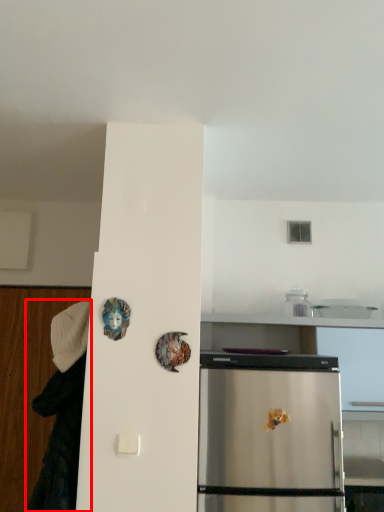
Question: From the image's perspective, what is the correct spatial positioning of couple (annotated by the red box) in reference to art?

Choices:
 (A) below
 (B) above

Answer: (A)